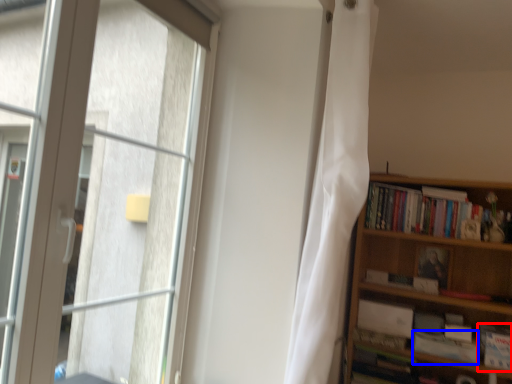
Question: Which of the following is the farthest to the observer, book (highlighted by a red box) or paperback book (highlighted by a blue box)?

Choices:
 (A) book
 (B) paperback book

Answer: (B)